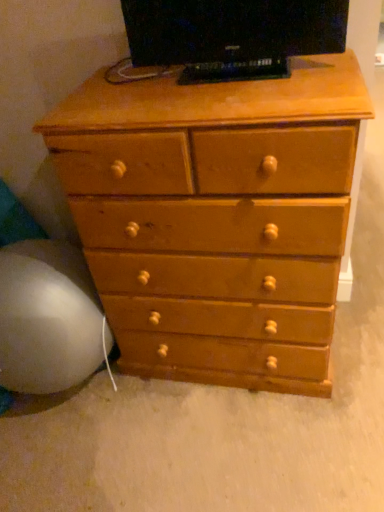
I want to click on free space to the left of matte black tv at upper center, so click(x=137, y=94).